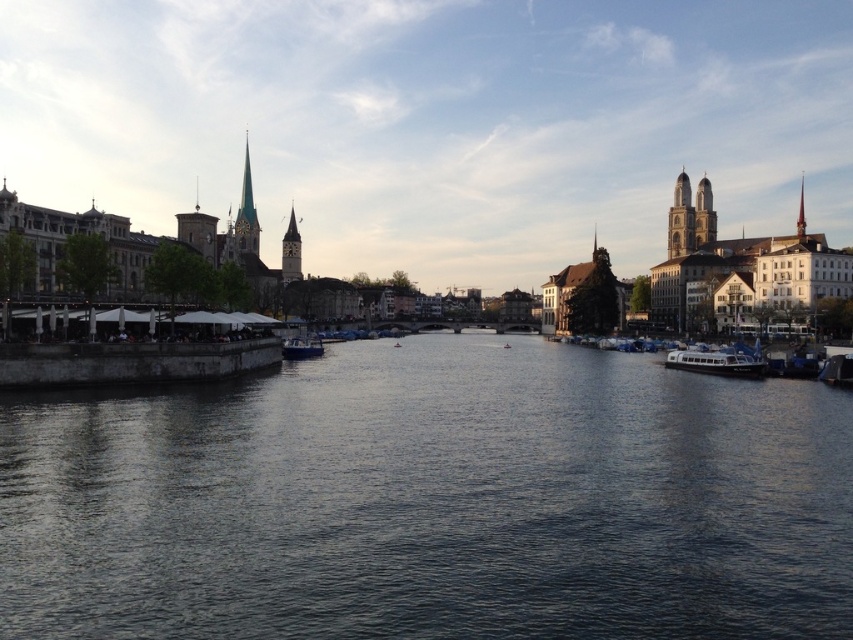
Question: Is white glossy boat at right wider than smooth stone spire at upper left?

Choices:
 (A) no
 (B) yes

Answer: (A)

Question: Among these points, which one is farthest from the camera?

Choices:
 (A) (700, 225)
 (B) (317, 353)
 (C) (84, 422)

Answer: (A)

Question: Estimate the real-world distances between objects in this image. Which object is farther from the smooth red spire at upper right?

Choices:
 (A) smooth stone tower at upper right
 (B) white glossy boat at right
 (C) metallic blue boat at right

Answer: (A)

Question: Which object is the closest to the white glossy boat at right?

Choices:
 (A) smooth stone tower at upper right
 (B) metallic blue boat at right
 (C) brown stone tower at upper right

Answer: (B)

Question: Does smooth stone clock tower at center have a greater width compared to smooth red spire at upper right?

Choices:
 (A) no
 (B) yes

Answer: (A)

Question: Is dark blue water at center positioned in front of smooth stone tower at upper right?

Choices:
 (A) no
 (B) yes

Answer: (B)